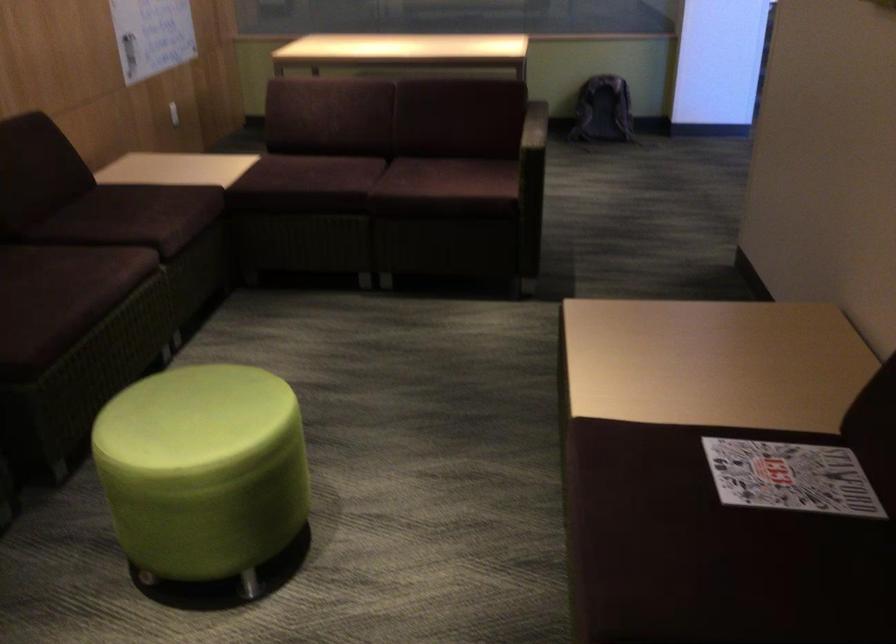
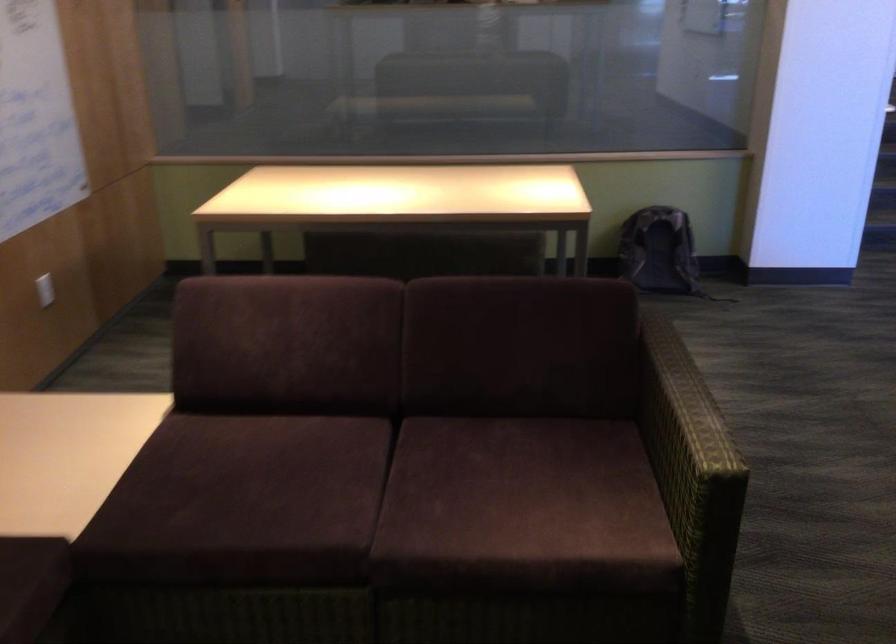
Find the pixel in the second image that matches [321,167] in the first image.

(269, 476)